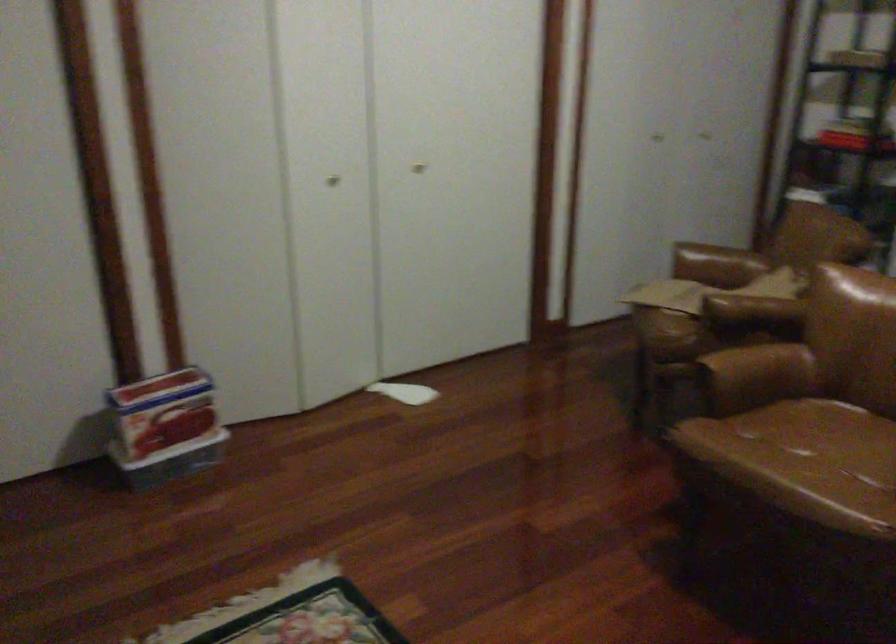
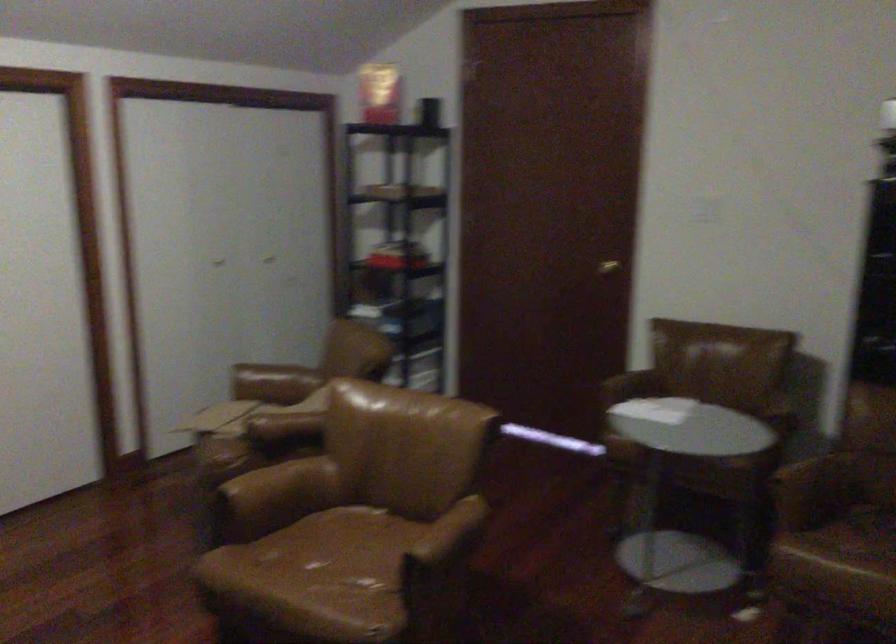
Find the pixel in the second image that matches [711,260] in the first image.

(273, 383)